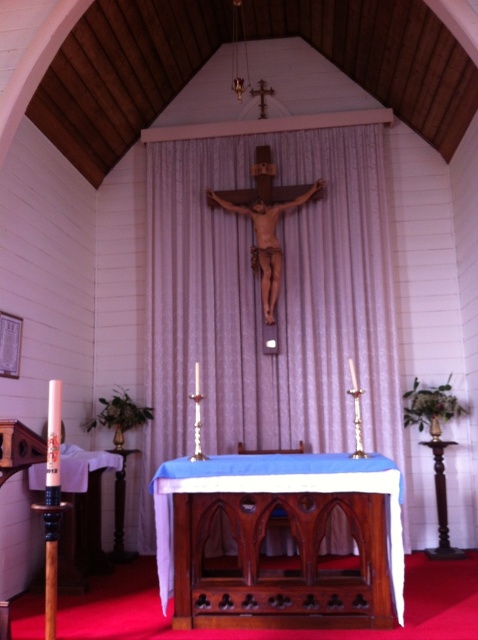
Is white fabric curtain at center behind wooden altar at center?

Yes.

Which is above, white fabric curtain at center or wooden altar at center?

white fabric curtain at center is higher up.

Between point (346, 237) and point (232, 476), which one is positioned behind?

The point (346, 237) is more distant.

You are a GUI agent. You are given a task and a screenshot of the screen. Output one action in this format:
    pyautogui.click(x=<x>, y=<y>)
    Task: Click on the white fabric curtain at center
    The height and width of the screenshot is (640, 478).
    Given the screenshot: What is the action you would take?
    pyautogui.click(x=278, y=300)